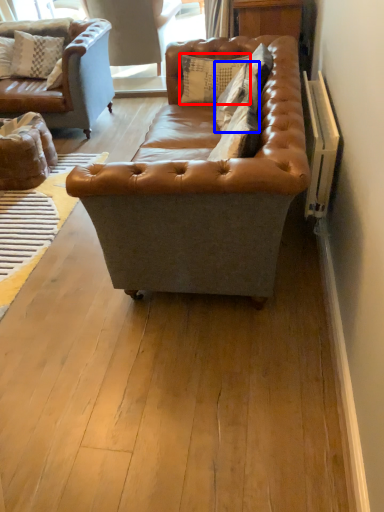
Question: Which point is further to the camera, pillow (highlighted by a red box) or pillow (highlighted by a blue box)?

Choices:
 (A) pillow
 (B) pillow

Answer: (A)